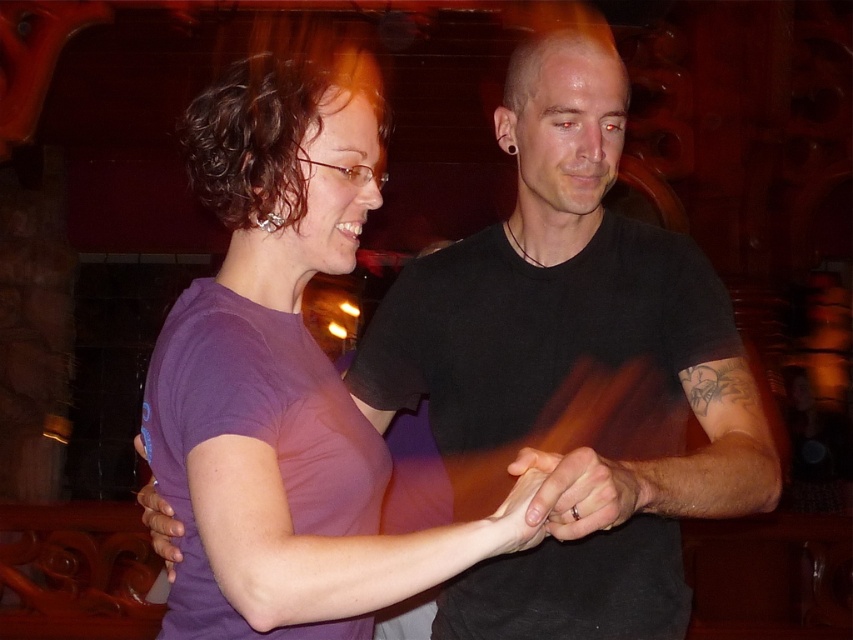
You are standing in front of the scene and want to determine which of the two points, point [524,45] or point [547,497], is closer to you. Based on the coordinates and the scene description, which point is nearer?

Point [524,45] is closer to you because it is further to the viewer than point [547,497] according to the description.

You are a photographer setting up for a group photo. You have two subjects in front of you. The first is wearing a purple matte shirt at center, and the second has a purple matte hand at lower left. The minimum focus distance of your camera is 16 inches. Will both subjects be in focus if you focus on the shirt?

The distance between the purple matte shirt at center and the purple matte hand at lower left is 15.96 inches, which is less than the camera minimum focus distance of 16 inches. Therefore, both subjects will be in focus.